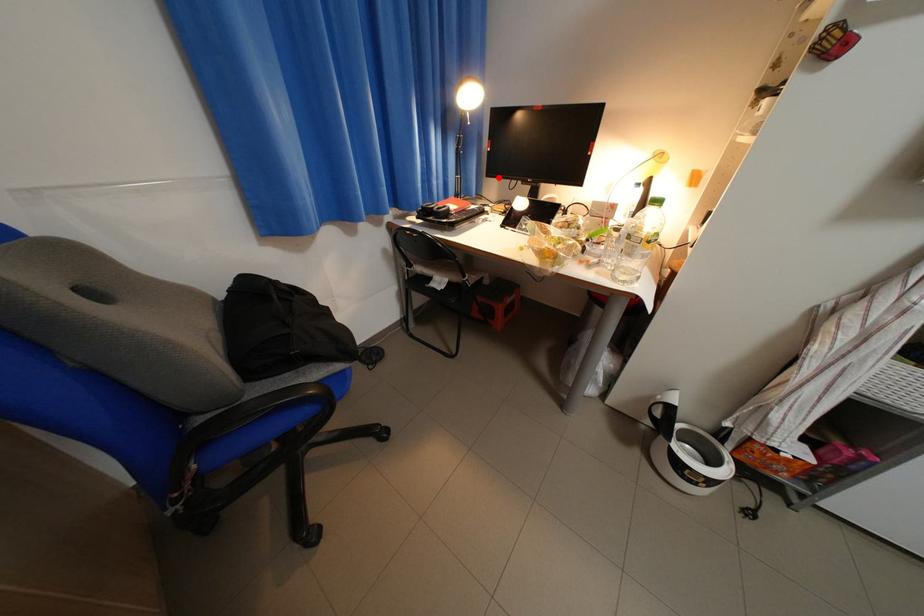
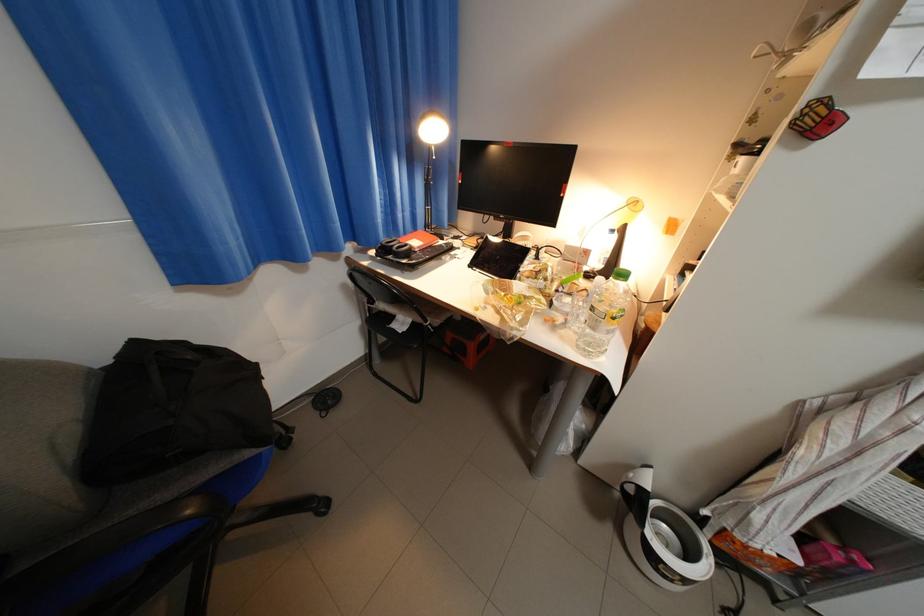
Question: I am providing you with two images of the same scene from different viewpoints. A red point is marked on the first image. Can you still see the location of the red point in image 2?

Choices:
 (A) Yes
 (B) No

Answer: (A)